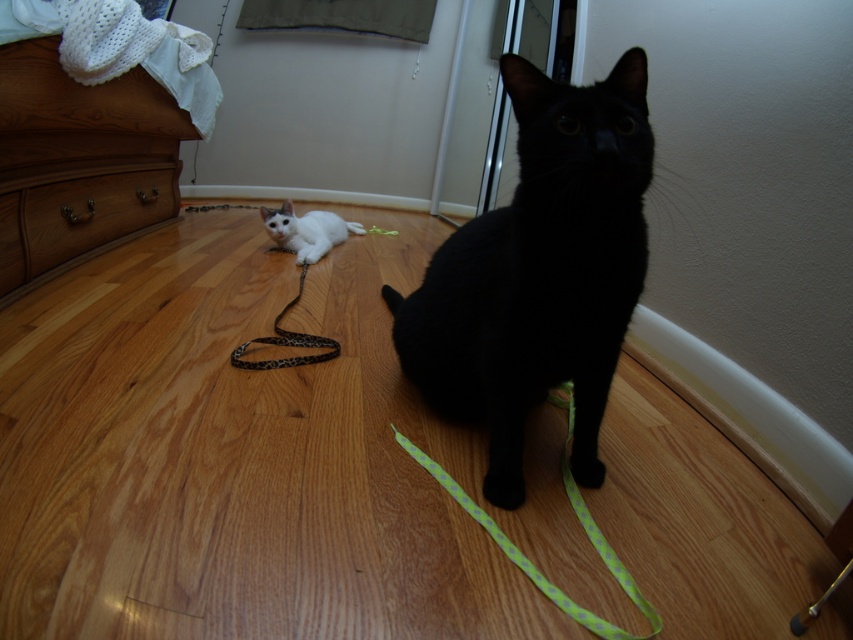
Question: Among these objects, which one is nearest to the camera?

Choices:
 (A) black glossy cat at center
 (B) leopard print fabric leash at center
 (C) brown wood drawer at left

Answer: (A)

Question: Is black glossy cat at center thinner than brown wood drawer at left?

Choices:
 (A) yes
 (B) no

Answer: (B)

Question: Among these points, which one is nearest to the camera?

Choices:
 (A) (296, 237)
 (B) (299, 337)

Answer: (B)

Question: Is black glossy cat at center positioned at the back of leopard print fabric leash at center?

Choices:
 (A) no
 (B) yes

Answer: (A)

Question: Which object is positioned closest to the leopard print fabric leash at center?

Choices:
 (A) white fur cat at lower left
 (B) black glossy cat at center

Answer: (B)

Question: Can you confirm if brown wood drawer at left is thinner than leopard print fabric leash at center?

Choices:
 (A) yes
 (B) no

Answer: (B)